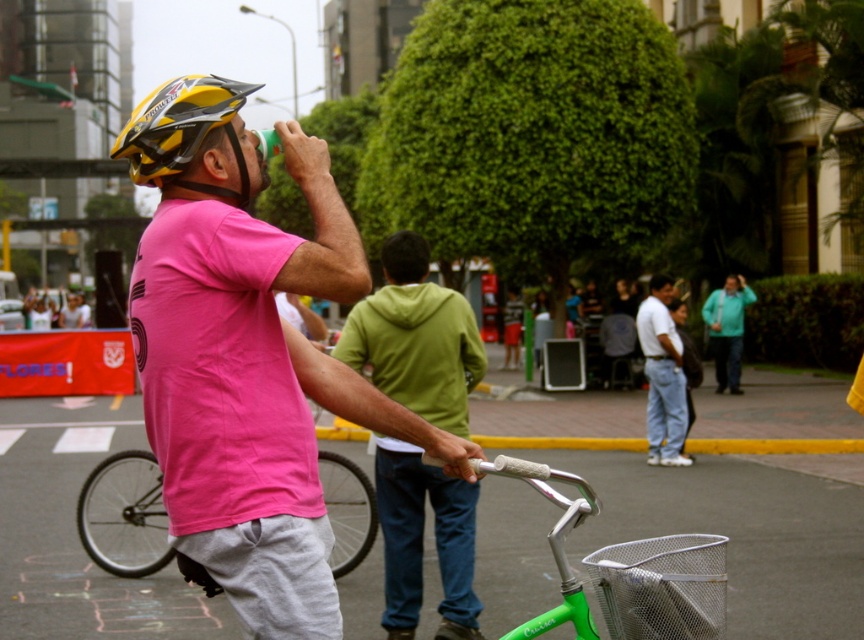
You are a photographer standing in the scene and want to take a photo of both the green matte hoodie at center and the yellow matte bicycle helmet at upper left. Which object should you adjust your camera focus first to ensure it is in the foreground?

The green matte hoodie at center should be focused first since it is closer to the photographer and in the foreground compared to the yellow matte bicycle helmet at upper left, which is farther away.

You are a delivery person who needs to quickly put a package on the pink matte shirt at center and the green matte bicycle at center. Which object requires more space to accommodate the package?

The green matte bicycle at center requires more space to accommodate the package since the pink matte shirt at center occupies less space than it.

You are standing in the middle of the street and see the pink matte shirt at center and the green matte hoodie at center. Which one is positioned more to the left?

The pink matte shirt at center is positioned to the left of the green matte hoodie at center, so the pink matte shirt at center is more to the left.